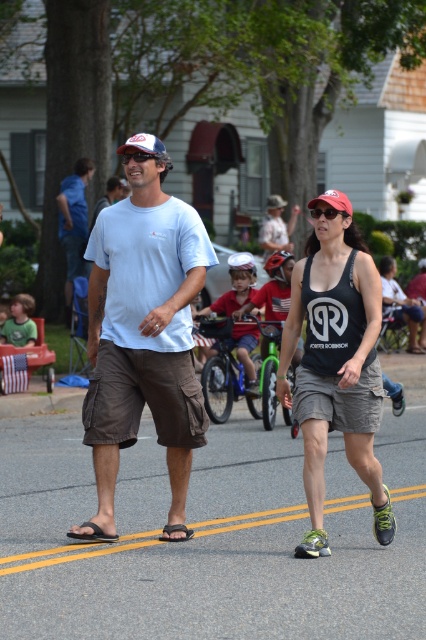
Question: Does matte white t-shirt at center have a smaller size compared to white cotton t-shirt at center?

Choices:
 (A) no
 (B) yes

Answer: (A)

Question: Can you confirm if matte white t-shirt at center is smaller than black tank top at center?

Choices:
 (A) yes
 (B) no

Answer: (A)

Question: Which point is closer to the camera?

Choices:
 (A) matte white t-shirt at center
 (B) matte blue t-shirt at center

Answer: (A)

Question: Which object is positioned farthest from the matte white t-shirt at center?

Choices:
 (A) matte blue t-shirt at center
 (B) matte black goggles at center
 (C) white cotton t-shirt at center
 (D) black tank top at center

Answer: (A)

Question: Which point is farther from the camera taking this photo?

Choices:
 (A) click(x=66, y=189)
 (B) click(x=118, y=288)
 (C) click(x=310, y=454)

Answer: (A)

Question: Considering the relative positions of white cotton t-shirt at center and matte black goggles at center in the image provided, where is white cotton t-shirt at center located with respect to matte black goggles at center?

Choices:
 (A) above
 (B) below

Answer: (B)